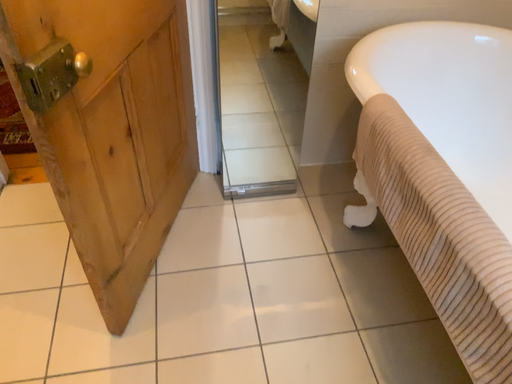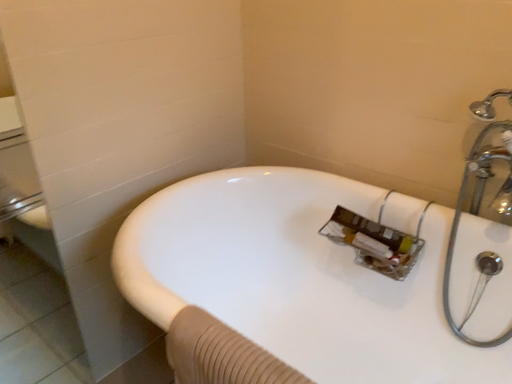
Question: Which way did the camera rotate in the video?

Choices:
 (A) rotated left
 (B) rotated right

Answer: (B)